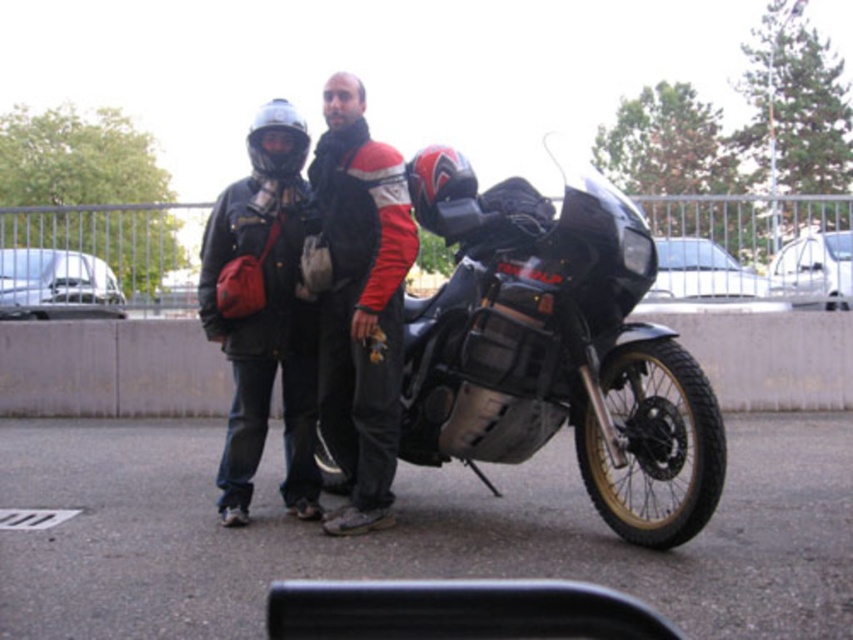
You are a delivery person who needs to load a package onto the black matte motorcycle at center. The package is the size of the matte black jacket at center. Can you fit the package on the motorcycle?

The black matte motorcycle at center is larger in size than the matte black jacket at center, so yes, the package can be placed on the motorcycle as it is smaller than the motorcycle.

You are a delivery person who needs to load a package onto the black matte motorcycle at center. The package is as wide as the matte black jacket at center. Will the package fit on the motorcycle?

The black matte motorcycle at center might be wider than matte black jacket at center. Therefore, the package, which is as wide as the matte black jacket at center, might fit on the motorcycle. However, there is uncertainty due to the comparison being uncertain.

You are a photographer positioned to the left of the scene. You want to capture a photo where the black matte motorcycle at center is on the right side of the matte black jacket at center. Is the current arrangement already suitable for your shot?

Yes, the current arrangement is suitable because the black matte motorcycle at center is already positioned to the right of the matte black jacket at center as described in the Objects Description.